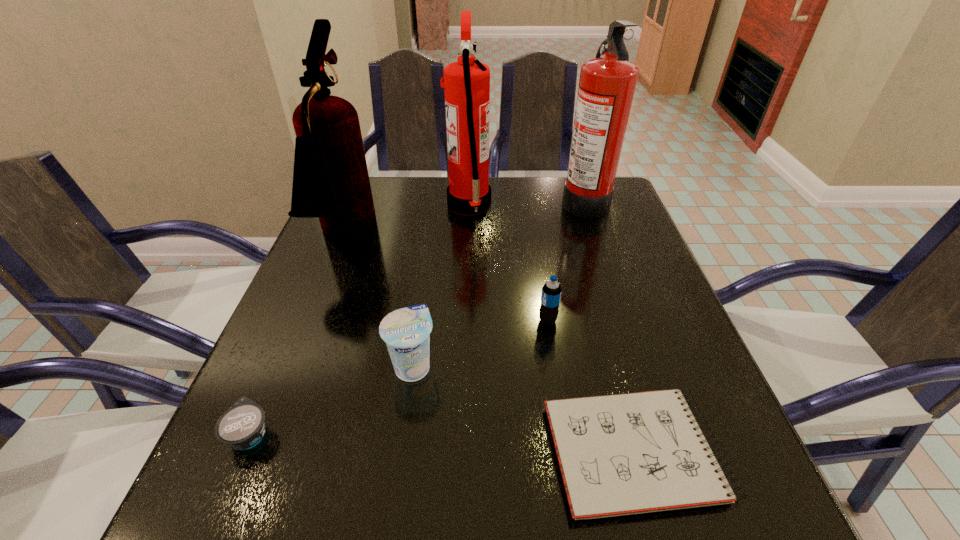
Image resolution: width=960 pixels, height=540 pixels. Find the location of `the rightmost fire extinguisher`. the rightmost fire extinguisher is located at coordinates (606, 88).

This screenshot has height=540, width=960. Find the location of `the second fire extinguisher from right to left`. the second fire extinguisher from right to left is located at coordinates (466, 82).

You are a GUI agent. You are given a task and a screenshot of the screen. Output one action in this format:
    pyautogui.click(x=<x>, y=<y>)
    Task: Click on the leftmost fire extinguisher
    This screenshot has height=540, width=960.
    Given the screenshot: What is the action you would take?
    pyautogui.click(x=330, y=178)

This screenshot has height=540, width=960. I want to click on the fourth nearest object, so click(551, 291).

Locate an element on the screen. Image resolution: width=960 pixels, height=540 pixels. the farther yogurt is located at coordinates (406, 331).

Find the location of a particular element. This screenshot has height=540, width=960. the taller yogurt is located at coordinates (406, 331).

I want to click on the second shortest object, so click(x=242, y=426).

You are a GUI agent. You are given a task and a screenshot of the screen. Output one action in this format:
    pyautogui.click(x=<x>, y=<y>)
    Task: Click on the shorter yogurt
    The height and width of the screenshot is (540, 960).
    Given the screenshot: What is the action you would take?
    pyautogui.click(x=242, y=426)

Identify the location of the shortest object. The width and height of the screenshot is (960, 540). (621, 454).

Where is `free region located 0.120m on the front-facing side of the rightmost fire extinguisher`? The height and width of the screenshot is (540, 960). free region located 0.120m on the front-facing side of the rightmost fire extinguisher is located at coordinates (518, 200).